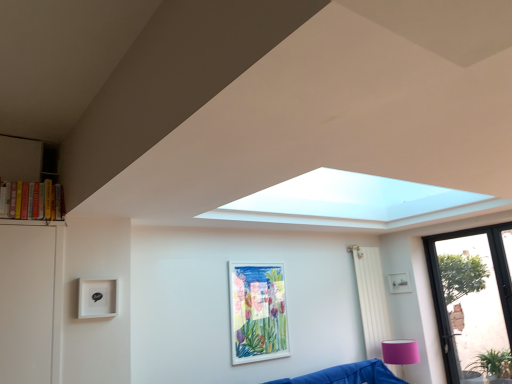
Question: Is point (20, 213) closer or farther from the camera than point (415, 347)?

Choices:
 (A) closer
 (B) farther

Answer: (A)

Question: Is hardcover books at left wider or thinner than pink fabric lampshade at lower right?

Choices:
 (A) thin
 (B) wide

Answer: (A)

Question: Based on their relative distances, which object is farther from the hardcover books at left?

Choices:
 (A) white fabric curtain at right
 (B) transparent glass door at lower right
 (C) pink fabric lampshade at lower right
 (D) white matte picture frame at center, marked as the first picture frame in a front-to-back arrangement
 (E) matte white picture frame at upper right, acting as the second picture frame starting from the left

Answer: (B)

Question: Estimate the real-world distances between objects in this image. Which object is closer to the matte white picture frame at upper right, the second picture frame when ordered from front to back?

Choices:
 (A) white fabric curtain at right
 (B) white matte picture frame at center, which is counted as the 1th picture frame, starting from the left
 (C) pink fabric lampshade at lower right
 (D) hardcover books at left
 (E) transparent glass door at lower right

Answer: (A)